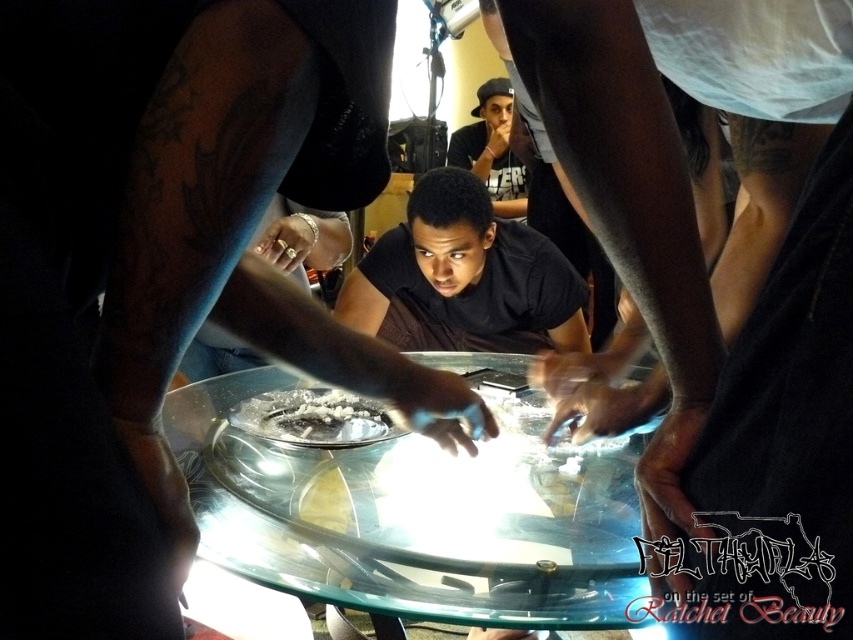
Question: Is transparent glass table at center positioned behind black matte shirt at center?

Choices:
 (A) no
 (B) yes

Answer: (A)

Question: Does black matte shirt at center come in front of matte black shirt at upper center?

Choices:
 (A) yes
 (B) no

Answer: (A)

Question: Does transparent glass table at center appear on the right side of matte black shirt at upper center?

Choices:
 (A) yes
 (B) no

Answer: (B)

Question: Among these objects, which one is farthest from the camera?

Choices:
 (A) black matte shirt at center
 (B) transparent glass table at center
 (C) matte black shirt at upper center
 (D) white powder at center

Answer: (C)

Question: Considering the real-world distances, which object is closest to the black matte shirt at center?

Choices:
 (A) white powder at center
 (B) matte black shirt at upper center
 (C) transparent glass table at center

Answer: (C)

Question: Which point is farther to the camera?

Choices:
 (A) (436, 248)
 (B) (431, 502)

Answer: (A)